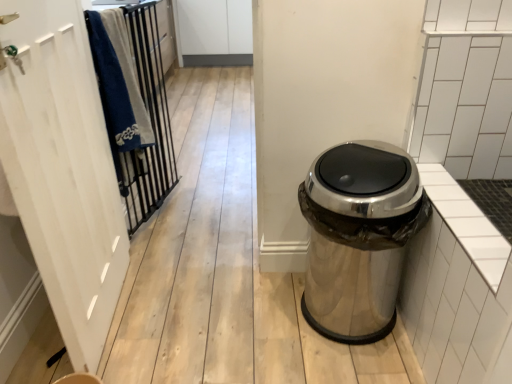
Question: Considering the relative sizes of polished metallic trash can at right and metallic black bars at left in the image provided, is polished metallic trash can at right wider than metallic black bars at left?

Choices:
 (A) no
 (B) yes

Answer: (B)

Question: Is polished metallic trash can at right surrounding metallic black bars at left?

Choices:
 (A) yes
 (B) no

Answer: (B)

Question: Does polished metallic trash can at right have a lesser height compared to metallic black bars at left?

Choices:
 (A) yes
 (B) no

Answer: (A)

Question: From the image's perspective, does polished metallic trash can at right appear higher than metallic black bars at left?

Choices:
 (A) no
 (B) yes

Answer: (A)

Question: Is polished metallic trash can at right further to camera compared to metallic black bars at left?

Choices:
 (A) no
 (B) yes

Answer: (A)

Question: Is polished metallic trash can at right inside the boundaries of metallic black bars at left, or outside?

Choices:
 (A) inside
 (B) outside

Answer: (B)

Question: Is point (347, 236) closer or farther from the camera than point (117, 14)?

Choices:
 (A) closer
 (B) farther

Answer: (A)

Question: From the image's perspective, is polished metallic trash can at right positioned above or below metallic black bars at left?

Choices:
 (A) above
 (B) below

Answer: (B)

Question: Is polished metallic trash can at right taller or shorter than metallic black bars at left?

Choices:
 (A) tall
 (B) short

Answer: (B)

Question: From the image's perspective, is metallic black bars at left positioned above or below white wood screen door at left?

Choices:
 (A) above
 (B) below

Answer: (A)

Question: Which is correct: metallic black bars at left is inside white wood screen door at left, or outside of it?

Choices:
 (A) inside
 (B) outside

Answer: (B)

Question: Relative to white wood screen door at left, is metallic black bars at left in front or behind?

Choices:
 (A) behind
 (B) front

Answer: (A)

Question: In terms of height, does metallic black bars at left look taller or shorter compared to white wood screen door at left?

Choices:
 (A) short
 (B) tall

Answer: (A)

Question: From a real-world perspective, relative to polished metallic trash can at right, is white wood screen door at left vertically above or below?

Choices:
 (A) above
 (B) below

Answer: (A)

Question: Is white wood screen door at left taller or shorter than polished metallic trash can at right?

Choices:
 (A) tall
 (B) short

Answer: (A)